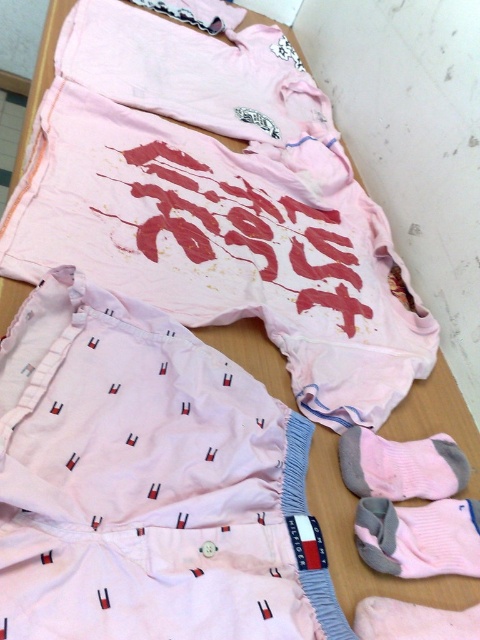
Does gray cotton sock at lower right have a larger size compared to pink cotton sock at lower right?

Yes.

Find the location of `gray cotton sock at lower right`. gray cotton sock at lower right is located at coordinates tap(400, 465).

Is pink cotton shorts at center smaller than pink cotton sock at lower right?

No.

Who is taller, pink cotton shorts at center or pink cotton sock at lower right?

With more height is pink cotton shorts at center.

Is point (201, 564) more distant than point (411, 628)?

No, (201, 564) is in front of (411, 628).

Where is `pink cotton shorts at center`? This screenshot has height=640, width=480. pink cotton shorts at center is located at coordinates (147, 483).

Is pink cotton shorts at lower left closer to camera compared to pink cotton sock at lower right?

No, it is behind pink cotton sock at lower right.

Between pink cotton shorts at lower left and pink cotton sock at lower right, which one appears on the left side from the viewer's perspective?

pink cotton shorts at lower left

The image size is (480, 640). Find the location of `pink cotton shorts at lower left`. pink cotton shorts at lower left is located at coordinates (217, 204).